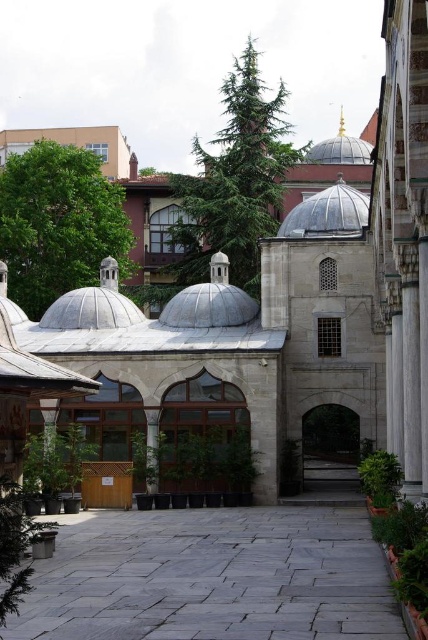
Question: Is gray stone courtyard at center positioned behind metallic silver dome at center?

Choices:
 (A) no
 (B) yes

Answer: (A)

Question: Is metallic silver dome at center below gold domed roof at center?

Choices:
 (A) yes
 (B) no

Answer: (A)

Question: Observing the image, what is the correct spatial positioning of gray stone courtyard at center in reference to gold domed roof at center?

Choices:
 (A) below
 (B) above

Answer: (A)

Question: Estimate the real-world distances between objects in this image. Which object is farther from the gray stone courtyard at center?

Choices:
 (A) metallic silver dome at center
 (B) gold domed roof at center

Answer: (B)

Question: Which point is farther to the camera?

Choices:
 (A) (302, 200)
 (B) (244, 554)

Answer: (A)

Question: Which is nearer to the metallic silver dome at center?

Choices:
 (A) gray stone courtyard at center
 (B) gold domed roof at center

Answer: (B)